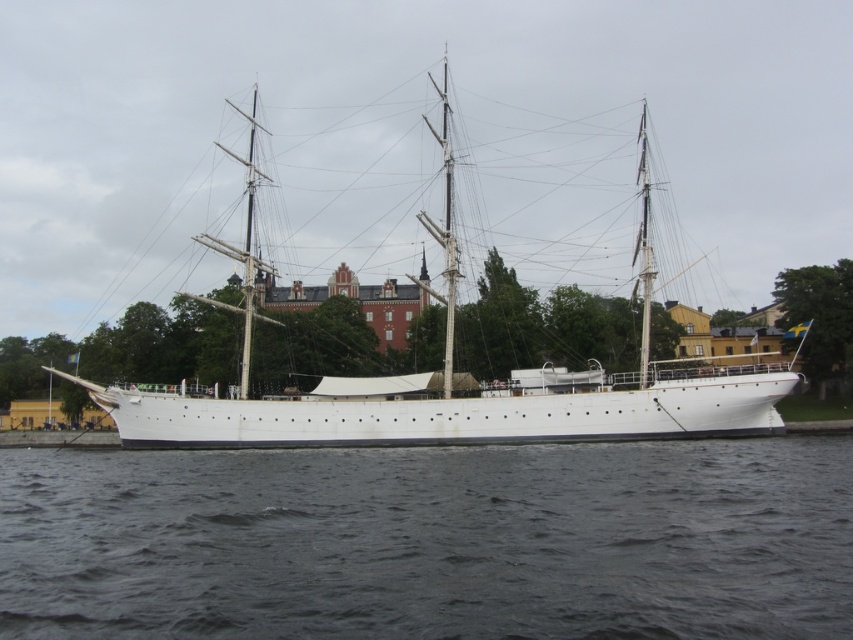
Between dark gray water at lower center and white matte sailboat at center, which one appears on the right side from the viewer's perspective?

dark gray water at lower center is more to the right.

Is point (538, 634) less distant than point (643, 412)?

Yes, it is in front of point (643, 412).

Find the location of a particular element. dark gray water at lower center is located at coordinates (430, 541).